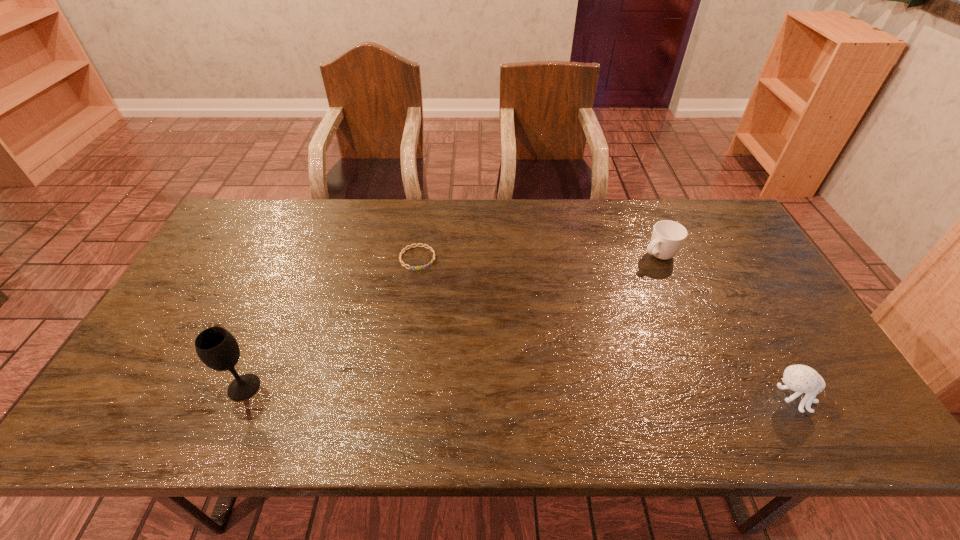
Locate an element on the screen. This screenshot has height=540, width=960. wineglass is located at coordinates (217, 348).

Identify the location of the leftmost object. (217, 348).

What are the coordinates of `the rightmost object` in the screenshot? It's located at (800, 378).

The image size is (960, 540). I want to click on cup, so click(668, 236).

You are a GUI agent. You are given a task and a screenshot of the screen. Output one action in this format:
    pyautogui.click(x=<x>, y=<y>)
    Task: Click on the third object from right to left
    
    Given the screenshot: What is the action you would take?
    pyautogui.click(x=417, y=268)

Find the location of a particular element. The image size is (960, 540). bracelet is located at coordinates (417, 268).

Find the location of a particular element. free space located on the right of the leftmost object is located at coordinates (391, 387).

Identify the location of vacant space located on the front-facing side of the octopus. (835, 398).

Where is `vacant region located 0.360m with the handle on the side of the cup`? The width and height of the screenshot is (960, 540). vacant region located 0.360m with the handle on the side of the cup is located at coordinates (560, 316).

This screenshot has height=540, width=960. What are the coordinates of `vacant space located with the handle on the side of the cup` in the screenshot? It's located at (603, 289).